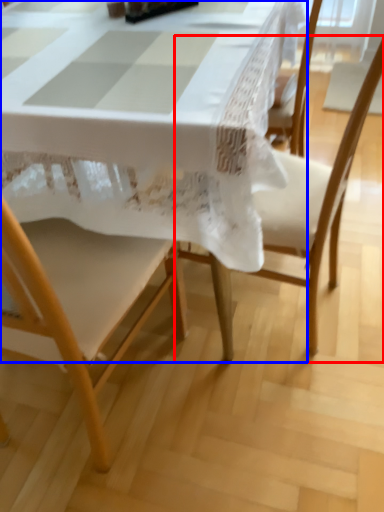
Question: Which object appears farthest to the camera in this image, chair (highlighted by a red box) or table (highlighted by a blue box)?

Choices:
 (A) chair
 (B) table

Answer: (B)